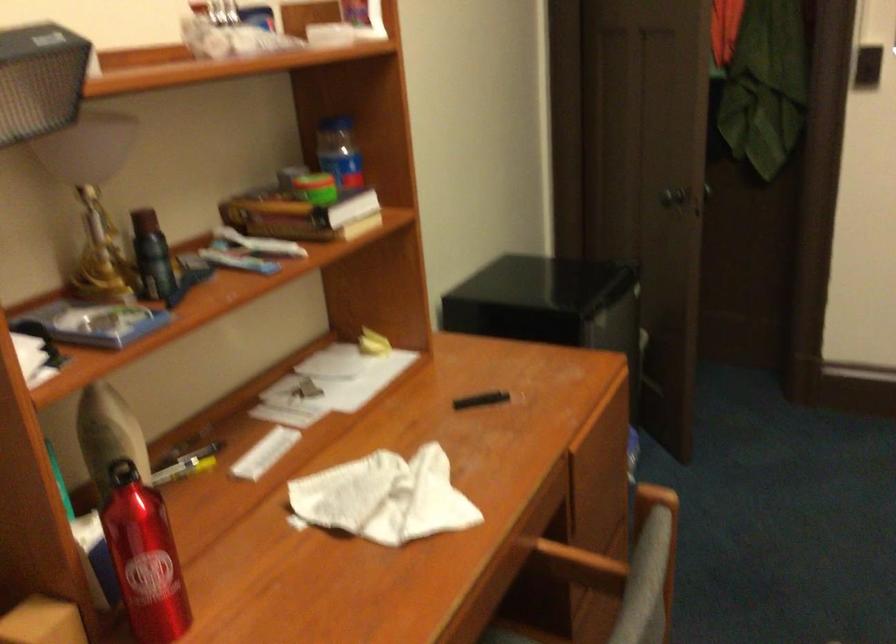
The width and height of the screenshot is (896, 644). I want to click on chair armrest, so click(579, 565).